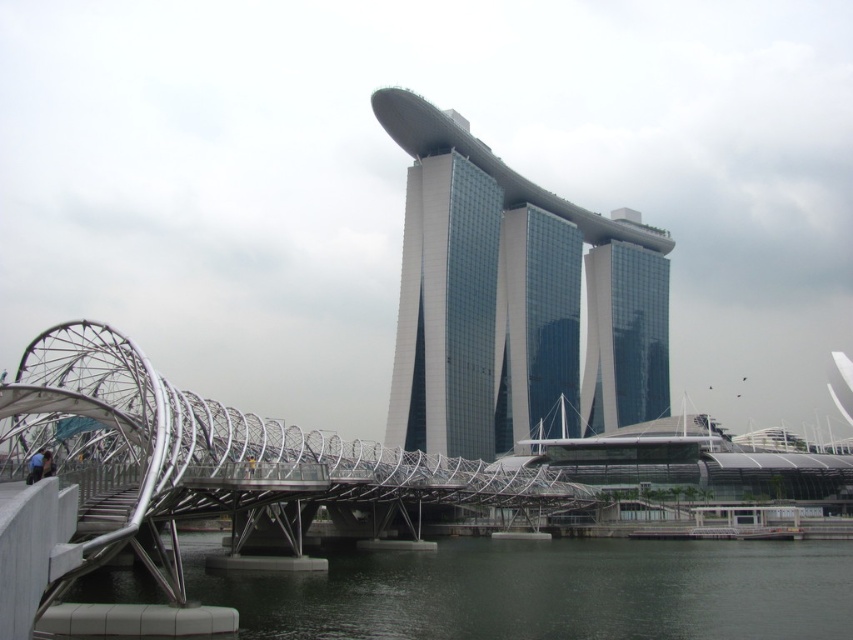
Question: Which object is the farthest from the metallic silver bridge at lower left?

Choices:
 (A) glassy steel tower at center
 (B) glassy steel skyscraper at center
 (C) dark gray water at lower center

Answer: (A)

Question: Is glassy steel tower at center smaller than glassy reflective skyscraper at center?

Choices:
 (A) yes
 (B) no

Answer: (A)

Question: Which point is farther from the camera taking this photo?

Choices:
 (A) (639, 611)
 (B) (482, 420)

Answer: (B)

Question: Is metallic silver bridge at lower left closer to the viewer compared to glassy steel tower at center?

Choices:
 (A) no
 (B) yes

Answer: (B)

Question: Does metallic silver bridge at lower left have a lesser width compared to dark gray water at lower center?

Choices:
 (A) yes
 (B) no

Answer: (A)

Question: Among these points, which one is nearest to the camera?

Choices:
 (A) click(x=453, y=225)
 (B) click(x=592, y=381)
 (C) click(x=570, y=360)

Answer: (A)